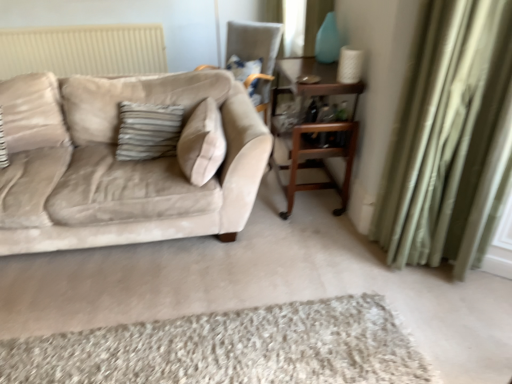
Question: Should I look upward or downward to see shaggy beige rug at lower center?

Choices:
 (A) down
 (B) up

Answer: (A)

Question: Is beige velvet couch at left to the left of velvet beige chair at upper center from the viewer's perspective?

Choices:
 (A) no
 (B) yes

Answer: (B)

Question: Is beige velvet couch at left with velvet beige chair at upper center?

Choices:
 (A) yes
 (B) no

Answer: (B)

Question: Is the depth of beige velvet couch at left less than that of velvet beige chair at upper center?

Choices:
 (A) no
 (B) yes

Answer: (B)

Question: Is beige velvet couch at left smaller than velvet beige chair at upper center?

Choices:
 (A) no
 (B) yes

Answer: (A)

Question: Considering the relative sizes of beige velvet couch at left and velvet beige chair at upper center in the image provided, is beige velvet couch at left thinner than velvet beige chair at upper center?

Choices:
 (A) no
 (B) yes

Answer: (A)

Question: Does beige velvet couch at left come behind velvet beige chair at upper center?

Choices:
 (A) yes
 (B) no

Answer: (B)

Question: Is beige velvet couch at left directly adjacent to shaggy beige rug at lower center?

Choices:
 (A) yes
 (B) no

Answer: (B)

Question: Is beige velvet couch at left at the right side of shaggy beige rug at lower center?

Choices:
 (A) no
 (B) yes

Answer: (A)

Question: From a real-world perspective, is beige velvet couch at left over shaggy beige rug at lower center?

Choices:
 (A) no
 (B) yes

Answer: (B)

Question: Considering the relative positions of beige velvet couch at left and shaggy beige rug at lower center in the image provided, is beige velvet couch at left in front of shaggy beige rug at lower center?

Choices:
 (A) yes
 (B) no

Answer: (B)

Question: Is shaggy beige rug at lower center completely or partially inside beige velvet couch at left?

Choices:
 (A) yes
 (B) no

Answer: (B)

Question: Is beige velvet couch at left not near shaggy beige rug at lower center?

Choices:
 (A) no
 (B) yes

Answer: (A)

Question: Does green velvet curtain at right have a lesser height compared to velvet beige chair at upper center?

Choices:
 (A) no
 (B) yes

Answer: (A)